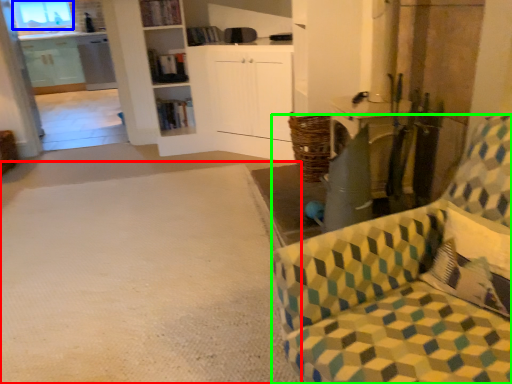
Question: Considering the real-world distances, which object is closest to plain (highlighted by a red box)? window (highlighted by a blue box) or chair (highlighted by a green box).

Choices:
 (A) window
 (B) chair

Answer: (B)